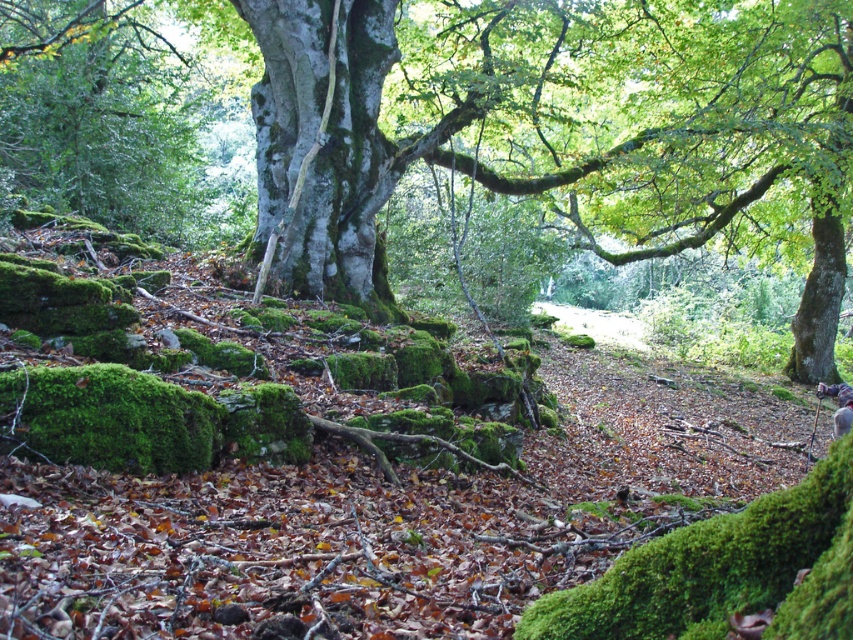
Question: Which point is farther to the camera?

Choices:
 (A) green mossy tree at center
 (B) smooth gray bark at center
 (C) camouflage fabric person at lower right

Answer: (C)

Question: Is the position of smooth gray bark at center more distant than that of camouflage fabric person at lower right?

Choices:
 (A) no
 (B) yes

Answer: (A)

Question: Among these objects, which one is nearest to the camera?

Choices:
 (A) smooth gray bark at center
 (B) camouflage fabric person at lower right
 (C) green mossy tree at center

Answer: (A)

Question: Is green mossy tree at center below smooth gray bark at center?

Choices:
 (A) yes
 (B) no

Answer: (B)

Question: Does smooth gray bark at center appear under camouflage fabric person at lower right?

Choices:
 (A) no
 (B) yes

Answer: (A)

Question: Which object appears closest to the camera in this image?

Choices:
 (A) camouflage fabric person at lower right
 (B) green mossy tree at center

Answer: (B)